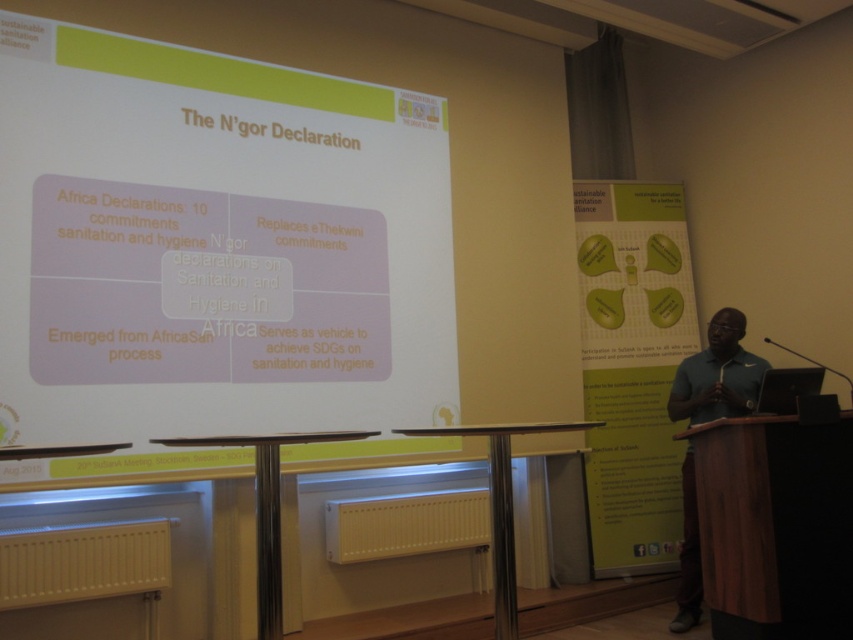
Question: Does white matte projection screen at upper center appear on the right side of dark green polo shirt at right?

Choices:
 (A) no
 (B) yes

Answer: (A)

Question: Which of the following is the closest to the observer?

Choices:
 (A) (689, 588)
 (B) (61, 48)

Answer: (B)

Question: Is white matte projection screen at upper center below dark green polo shirt at right?

Choices:
 (A) yes
 (B) no

Answer: (B)

Question: Which point is closer to the camera?

Choices:
 (A) (729, 371)
 (B) (3, 262)

Answer: (B)

Question: Does white matte projection screen at upper center appear under dark green polo shirt at right?

Choices:
 (A) yes
 (B) no

Answer: (B)

Question: Which point is farther from the camera taking this photo?

Choices:
 (A) (175, 362)
 (B) (670, 403)

Answer: (B)